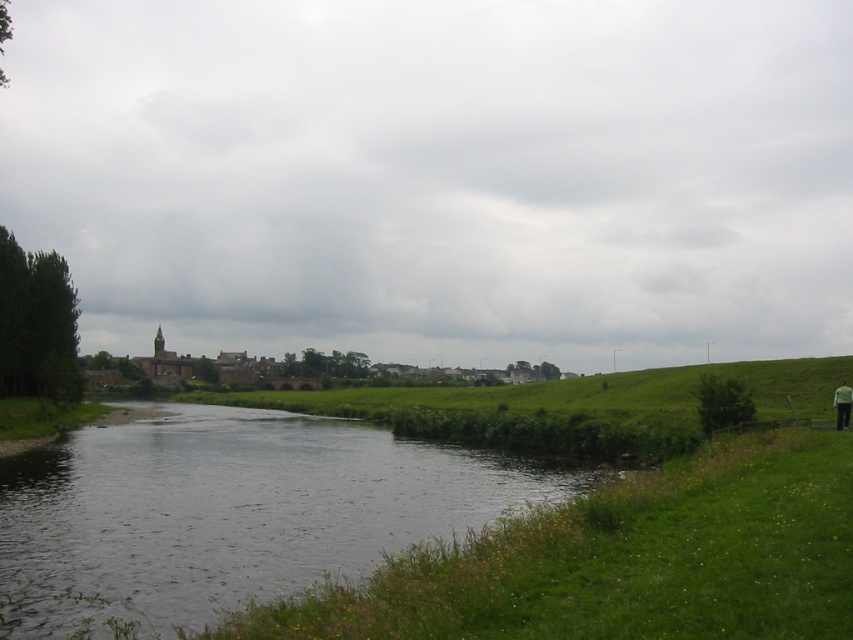
Question: Is green grassy at lower right below green fabric person at lower right?

Choices:
 (A) yes
 (B) no

Answer: (A)

Question: Among these points, which one is farthest from the camera?

Choices:
 (A) (842, 410)
 (B) (631, 556)

Answer: (A)

Question: Does green grassy at lower right lie behind green fabric person at lower right?

Choices:
 (A) no
 (B) yes

Answer: (A)

Question: Can you confirm if green grassy at lower right is positioned to the left of green fabric person at lower right?

Choices:
 (A) yes
 (B) no

Answer: (A)

Question: Which object appears farthest from the camera in this image?

Choices:
 (A) green fabric person at lower right
 (B) green grassy at lower right

Answer: (A)